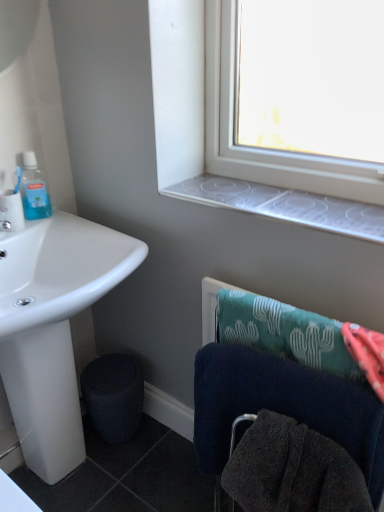
Question: Is clear plastic window sill at upper center touching dark blue towel at lower right?

Choices:
 (A) no
 (B) yes

Answer: (A)

Question: Considering the relative sizes of clear plastic window sill at upper center and dark blue towel at lower right in the image provided, is clear plastic window sill at upper center smaller than dark blue towel at lower right?

Choices:
 (A) no
 (B) yes

Answer: (B)

Question: Does clear plastic window sill at upper center have a lesser width compared to dark blue towel at lower right?

Choices:
 (A) yes
 (B) no

Answer: (B)

Question: From a real-world perspective, is clear plastic window sill at upper center under dark blue towel at lower right?

Choices:
 (A) no
 (B) yes

Answer: (A)

Question: Can you confirm if clear plastic window sill at upper center is shorter than dark blue towel at lower right?

Choices:
 (A) yes
 (B) no

Answer: (A)

Question: Considering the positions of black matte trash bin/can at lower left and matte white toothbrush at left in the image, is black matte trash bin/can at lower left bigger or smaller than matte white toothbrush at left?

Choices:
 (A) big
 (B) small

Answer: (A)

Question: From the image's perspective, is black matte trash bin/can at lower left positioned above or below matte white toothbrush at left?

Choices:
 (A) below
 (B) above

Answer: (A)

Question: From a real-world perspective, is black matte trash bin/can at lower left physically located above or below matte white toothbrush at left?

Choices:
 (A) below
 (B) above

Answer: (A)

Question: Visually, is black matte trash bin/can at lower left positioned to the left or to the right of matte white toothbrush at left?

Choices:
 (A) left
 (B) right

Answer: (B)

Question: Is point (46, 212) positioned closer to the camera than point (375, 237)?

Choices:
 (A) farther
 (B) closer

Answer: (A)

Question: Which is correct: translucent plastic mouthwash at upper left is inside clear plastic window sill at upper center, or outside of it?

Choices:
 (A) outside
 (B) inside

Answer: (A)

Question: From a real-world perspective, is translucent plastic mouthwash at upper left physically located above or below clear plastic window sill at upper center?

Choices:
 (A) above
 (B) below

Answer: (B)

Question: Considering the positions of translucent plastic mouthwash at upper left and clear plastic window sill at upper center in the image, is translucent plastic mouthwash at upper left bigger or smaller than clear plastic window sill at upper center?

Choices:
 (A) small
 (B) big

Answer: (A)

Question: Considering the positions of dark blue towel at lower right and white glossy sink at lower left in the image, is dark blue towel at lower right taller or shorter than white glossy sink at lower left?

Choices:
 (A) short
 (B) tall

Answer: (A)

Question: Is dark blue towel at lower right in front of or behind white glossy sink at lower left in the image?

Choices:
 (A) front
 (B) behind

Answer: (A)